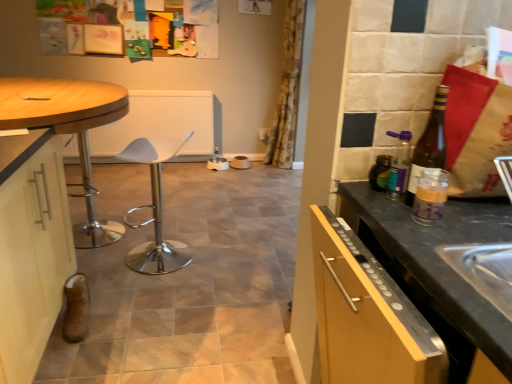
Find the location of a particular element. Image resolution: width=512 pixels, height=384 pixels. free space behind white plastic bar stool at center is located at coordinates (178, 230).